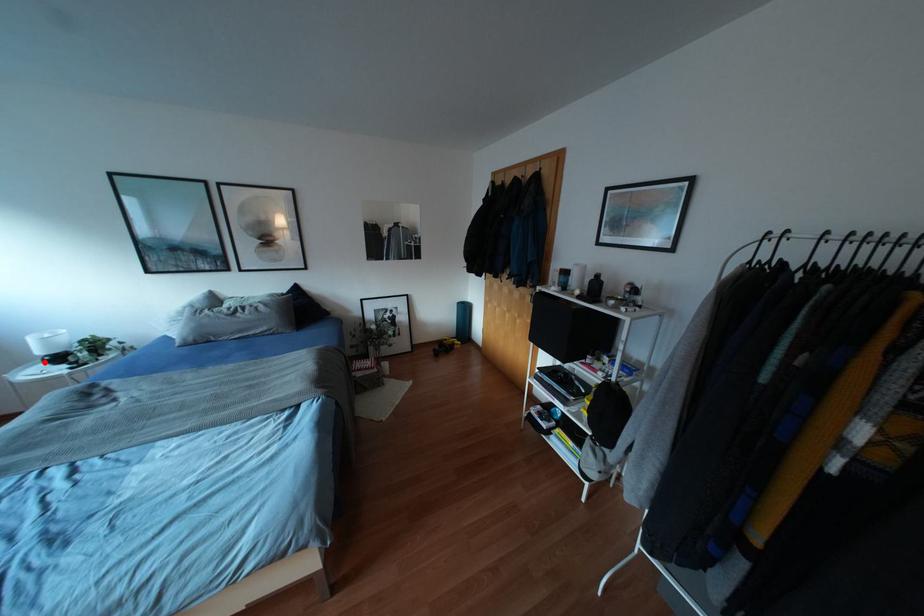
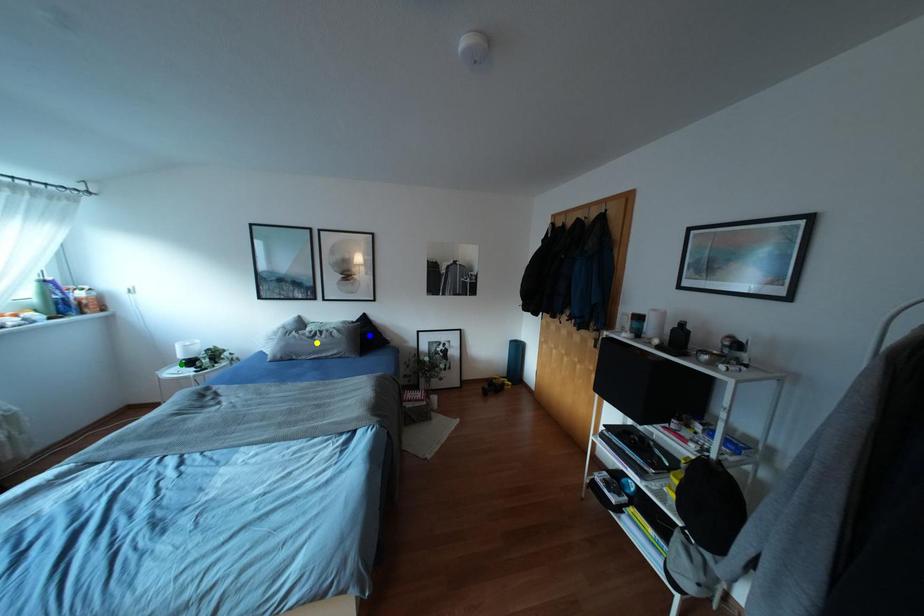
Question: I am providing you with two images of the same scene from different viewpoints. A red point is marked on the first image. You are given multiple points on the second image. Which spot in image 2 lines up with the point in image 1?

Choices:
 (A) green point
 (B) blue point
 (C) yellow point

Answer: (A)